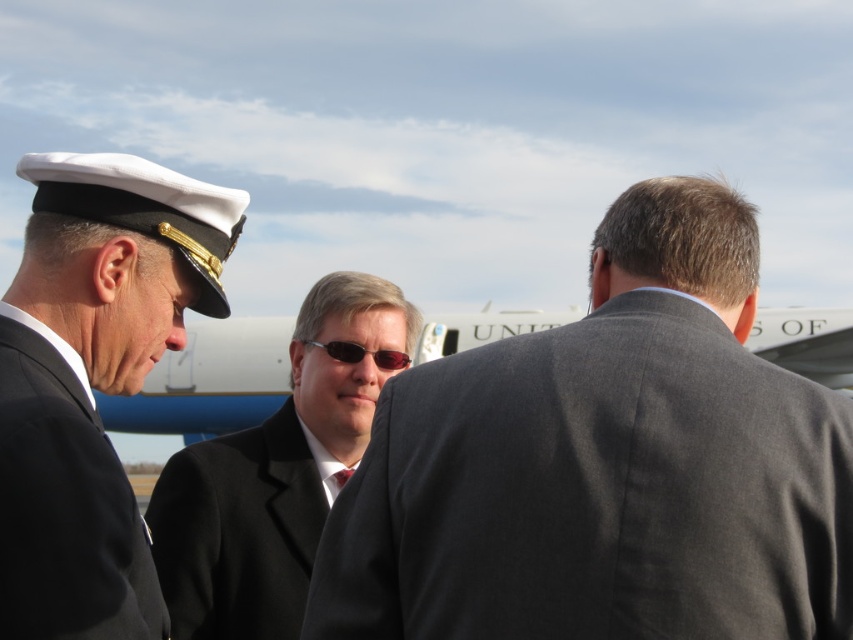
Is dark gray suit at center thinner than sunglasses at center?

No.

Based on the photo, can you confirm if dark gray suit at center is shorter than sunglasses at center?

No.

In the scene shown: Measure the distance between dark gray suit at center and camera.

dark gray suit at center is 41.43 feet from camera.

The image size is (853, 640). What are the coordinates of `dark gray suit at center` in the screenshot? It's located at (605, 465).

Can you confirm if white matte cap at left is positioned below sunglasses at center?

Yes.

Does white matte cap at left have a lesser height compared to sunglasses at center?

In fact, white matte cap at left may be taller than sunglasses at center.

Locate an element on the screen. Image resolution: width=853 pixels, height=640 pixels. white matte cap at left is located at coordinates (93, 380).

Who is shorter, dark gray suit at center or white matte cap at left?

With less height is dark gray suit at center.

Can you confirm if dark gray suit at center is positioned to the left of white matte cap at left?

In fact, dark gray suit at center is to the right of white matte cap at left.

Does point (344, 532) come behind point (76, 225)?

No, it is in front of (76, 225).

Find the location of a particular element. The height and width of the screenshot is (640, 853). dark gray suit at center is located at coordinates [x=605, y=465].